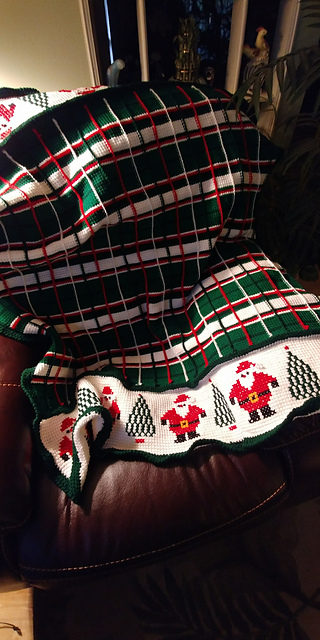
Locate an element on the screen. The image size is (320, 640). green, red, and black sheet is located at coordinates (131, 177).